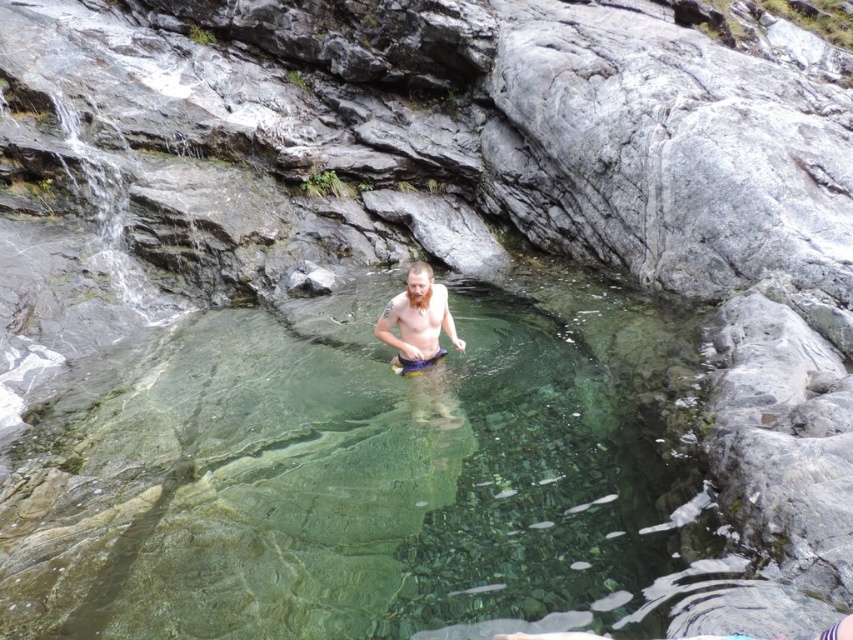
Question: Among these objects, which one is nearest to the camera?

Choices:
 (A) purple fabric shorts at center
 (B) clear glassy water at center

Answer: (B)

Question: Can you confirm if clear glassy water at center is smaller than purple fabric shorts at center?

Choices:
 (A) yes
 (B) no

Answer: (A)

Question: Which of the following is the farthest from the observer?

Choices:
 (A) clear glassy water at center
 (B) purple fabric shorts at center

Answer: (B)

Question: Considering the relative positions of clear glassy water at center and purple fabric shorts at center in the image provided, where is clear glassy water at center located with respect to purple fabric shorts at center?

Choices:
 (A) right
 (B) left

Answer: (B)

Question: Is the position of clear glassy water at center less distant than that of purple fabric shorts at center?

Choices:
 (A) yes
 (B) no

Answer: (A)

Question: Which point is farther to the camera?

Choices:
 (A) (416, 355)
 (B) (566, 600)

Answer: (A)